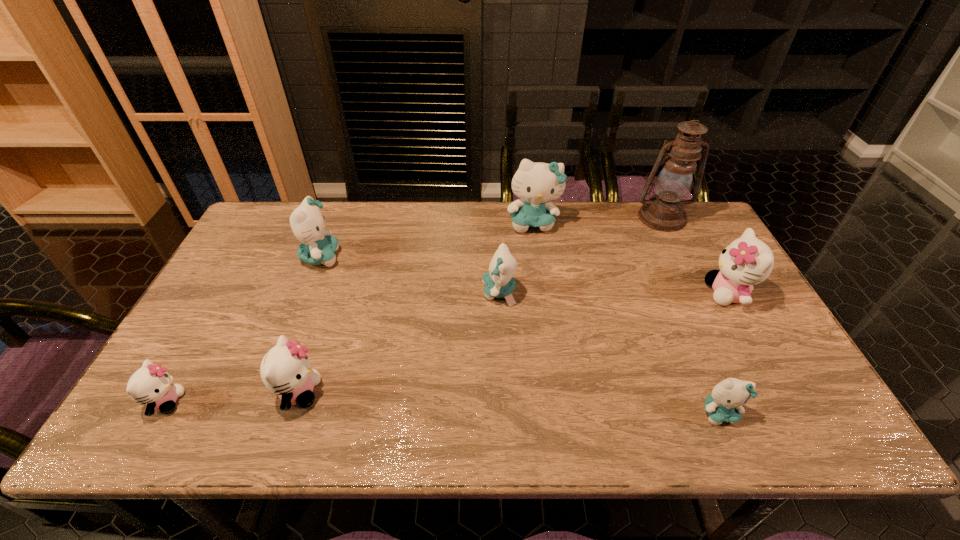
Locate an element on the screen. The image size is (960, 540). vacant space located 0.190m on the face of the second smallest blue kitten is located at coordinates (416, 292).

Image resolution: width=960 pixels, height=540 pixels. I want to click on vacant space located 0.190m on the face of the second smallest blue kitten, so click(x=416, y=292).

The height and width of the screenshot is (540, 960). I want to click on vacant space situated on the front-facing side of the second smallest white kitten, so click(445, 393).

The height and width of the screenshot is (540, 960). I want to click on blank area located 0.220m on the front-facing side of the smallest white kitten, so click(279, 402).

The height and width of the screenshot is (540, 960). In order to click on oil lamp located at the far edge in this screenshot , I will do `click(664, 211)`.

Where is `object that is at the left edge`? object that is at the left edge is located at coordinates (151, 384).

You are a GUI agent. You are given a task and a screenshot of the screen. Output one action in this format:
    pyautogui.click(x=<x>, y=<y>)
    Task: Click on the oil lamp that is at the right edge
    This screenshot has height=540, width=960.
    Given the screenshot: What is the action you would take?
    (x=664, y=211)

Find the location of a particular element. kitten situated at the right edge is located at coordinates (747, 261).

Image resolution: width=960 pixels, height=540 pixels. Find the location of `object at the near left corner`. object at the near left corner is located at coordinates (151, 384).

Where is `object positioned at the far right corner`? This screenshot has width=960, height=540. object positioned at the far right corner is located at coordinates (664, 211).